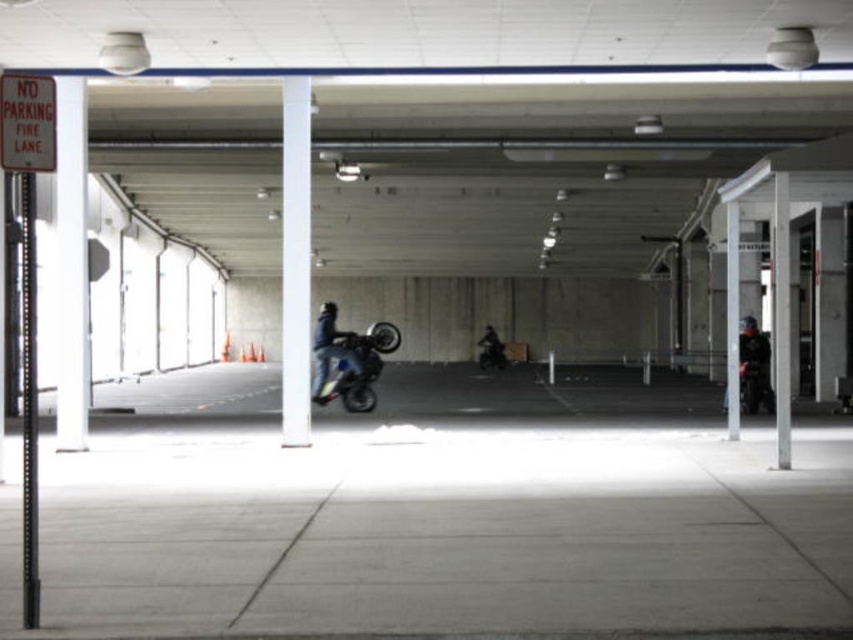
Question: Can you confirm if black glossy pole at left is positioned above dark blue leather jacket at center?

Choices:
 (A) yes
 (B) no

Answer: (A)

Question: Is black glossy pole at left closer to the viewer compared to shiny blue motorcycle at center?

Choices:
 (A) no
 (B) yes

Answer: (B)

Question: Which point is closer to the camera?

Choices:
 (A) dark blue leather jacket at center
 (B) black glossy pole at left
 (C) shiny blue motorcycle at center

Answer: (B)

Question: Which point appears closest to the camera in this image?

Choices:
 (A) (485, 362)
 (B) (502, 355)

Answer: (A)

Question: Can you confirm if shiny metallic motorcycle at center is positioned below dark blue leather jacket at center?

Choices:
 (A) no
 (B) yes

Answer: (A)

Question: Which point is closer to the camera?

Choices:
 (A) (496, 352)
 (B) (0, 134)

Answer: (B)